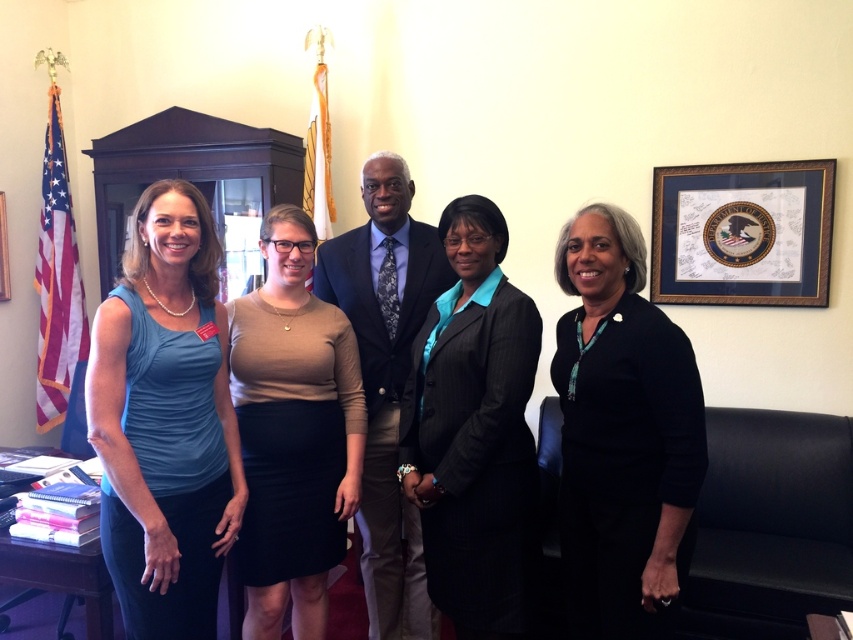
You are standing in the office scene described. You need to locate the black velvet blazer at center. Where is it positioned relative to the American flag and the other flag with gold fringe?

The black velvet blazer at center is positioned at point 0.681 on the x axis and 0.730 on the y axis, but since the exact coordinates aren not provided for the American flag and the other flag with gold fringe, I cannot determine their relative positions.

You are a security guard standing in the office and need to check the ID badge of the person wearing the black pinstripe suit at center. If your reach is 1.5 meters, can you reach them without moving closer?

The distance between you and the black pinstripe suit at center is 1.83 meters, which is beyond your 1.5 meter reach. You need to move closer to check their ID badge.